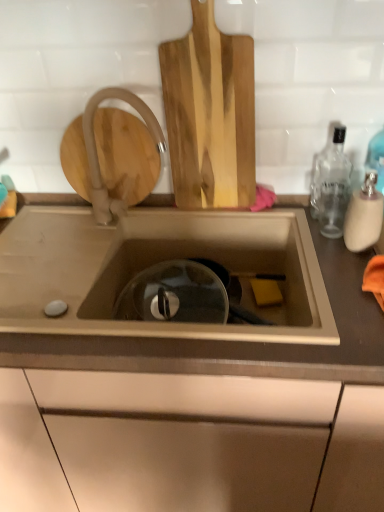
I want to click on blank space to the left of translucent glass bottle at right, which appears as the second bottle when viewed from the back, so click(311, 248).